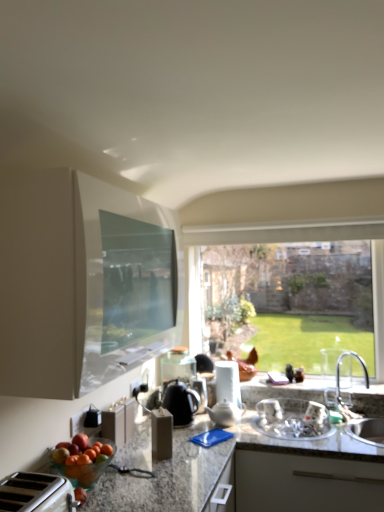
Describe the element at coordinates (367, 431) in the screenshot. This screenshot has height=512, width=384. I see `white ceramic sink at right, arranged as the 1th sink when viewed from the right` at that location.

Measure the distance between point [356,225] and camera.

Point [356,225] and camera are 8.39 feet apart.

Measure the distance between white glossy kettle at center, the 2th appliance when ordered from front to back, and camera.

They are 2.30 meters apart.

In order to face white glossy kettle at center, which is the second appliance in back-to-front order, should I rotate leftwards or rightwards?

Turn right approximately 1.144 degrees to face it.

What do you see at coordinates (228, 382) in the screenshot?
I see `white glossy paper towel dispenser at center, which is counted as the third appliance, starting from the front` at bounding box center [228, 382].

Locate an element on the screen. The width and height of the screenshot is (384, 512). white glossy cabinet at upper left, which is the second cabinetry from bottom to top is located at coordinates (80, 282).

At what (x,y) coordinates should I click in order to perform the action: click on white glossy sink at lower center, the 1th sink in the left-to-right sequence. Please return your answer as a coordinate pair (x, y). The height and width of the screenshot is (512, 384). Looking at the image, I should click on (293, 419).

From the image's perspective, which appliance is the 1st one below the clear glass window at center? Please provide its 2D coordinates.

[(228, 382)]

From a real-world perspective, which is physically above, white glossy paper towel dispenser at center, acting as the 1th appliance starting from the right, or clear glass window at center?

clear glass window at center is physically above.

Considering the relative positions of white glossy paper towel dispenser at center, which is counted as the third appliance, starting from the front, and clear glass window at center in the image provided, is white glossy paper towel dispenser at center, which is counted as the third appliance, starting from the front, to the right of clear glass window at center from the viewer's perspective?

No, white glossy paper towel dispenser at center, which is counted as the third appliance, starting from the front, is not to the right of clear glass window at center.

Is white glossy kettle at center, positioned as the second appliance in right-to-left order, at the back of clear glass window at center?

No, clear glass window at center is not facing the opposite direction of white glossy kettle at center, positioned as the second appliance in right-to-left order.

In order to click on window located behind the white glossy kettle at center, the 2th appliance when ordered from front to back in this screenshot , I will do `click(312, 239)`.

How many degrees apart are the facing directions of clear glass window at center and white glossy kettle at center, which is the 2th appliance from left to right?

The facing directions of clear glass window at center and white glossy kettle at center, which is the 2th appliance from left to right, are 4.83 degrees apart.

Considering the sizes of objects white glossy sink at lower center, the second sink from the right, and translucent glass bowl of mixed fruits at lower left in the image provided, who is smaller, white glossy sink at lower center, the second sink from the right, or translucent glass bowl of mixed fruits at lower left?

With smaller size is translucent glass bowl of mixed fruits at lower left.

Where is `fruit above the white glossy sink at lower center, the 1th sink in the left-to-right sequence (from the image's perspective)`? This screenshot has height=512, width=384. fruit above the white glossy sink at lower center, the 1th sink in the left-to-right sequence (from the image's perspective) is located at coordinates (85, 468).

Based on the photo, from the image's perspective, which is above, white glossy sink at lower center, the second sink from the right, or translucent glass bowl of mixed fruits at lower left?

translucent glass bowl of mixed fruits at lower left appears higher in the image.

Between white glossy sink at lower center, the 1th sink in the left-to-right sequence, and translucent glass bowl of mixed fruits at lower left, which one is positioned in front?

translucent glass bowl of mixed fruits at lower left is more forward.

Does white glossy sink at lower center, the second sink from the right, have a smaller size compared to clear glass window at center?

Yes, white glossy sink at lower center, the second sink from the right, is smaller than clear glass window at center.

Which is behind, white glossy sink at lower center, the 1th sink in the left-to-right sequence, or clear glass window at center?

clear glass window at center is further away from the camera.

Could you tell me if white glossy sink at lower center, the 1th sink in the left-to-right sequence, is facing clear glass window at center?

No, white glossy sink at lower center, the 1th sink in the left-to-right sequence, is not facing towards clear glass window at center.

Considering the relative sizes of white glossy sink at lower center, the second sink from the right, and clear glass window at center in the image provided, is white glossy sink at lower center, the second sink from the right, taller than clear glass window at center?

No.

Considering the relative sizes of white glossy sink at lower center, the second sink from the right, and white ceramic sink at right, placed as the second sink when sorted from left to right, in the image provided, is white glossy sink at lower center, the second sink from the right, taller than white ceramic sink at right, placed as the second sink when sorted from left to right,?

No, white glossy sink at lower center, the second sink from the right, is not taller than white ceramic sink at right, placed as the second sink when sorted from left to right.

Considering the sizes of objects white glossy sink at lower center, the 1th sink in the left-to-right sequence, and white ceramic sink at right, arranged as the 1th sink when viewed from the right, in the image provided, who is bigger, white glossy sink at lower center, the 1th sink in the left-to-right sequence, or white ceramic sink at right, arranged as the 1th sink when viewed from the right,?

white ceramic sink at right, arranged as the 1th sink when viewed from the right, is bigger.

From a real-world perspective, is white glossy sink at lower center, the 1th sink in the left-to-right sequence, above or below white ceramic sink at right, placed as the second sink when sorted from left to right?

In terms of real-world spatial position, white glossy sink at lower center, the 1th sink in the left-to-right sequence, is below white ceramic sink at right, placed as the second sink when sorted from left to right.

What's the angular difference between white glossy sink at lower center, the second sink from the right, and white ceramic sink at right, arranged as the 1th sink when viewed from the right,'s facing directions?

There is a 0.000408-degree angle between the facing directions of white glossy sink at lower center, the second sink from the right, and white ceramic sink at right, arranged as the 1th sink when viewed from the right.

How different are the orientations of white glossy kettle at center, which is the second appliance in back-to-front order, and matte white toaster at lower center, the second cabinetry viewed from the top, in degrees?

The angle between the facing direction of white glossy kettle at center, which is the second appliance in back-to-front order, and the facing direction of matte white toaster at lower center, the second cabinetry viewed from the top, is 95.1 degrees.

In order to click on the 2nd cabinetry counting from the left side of the white glossy kettle at center, which is the second appliance in back-to-front order in this screenshot , I will do `click(119, 421)`.

From a real-world perspective, which object stands above the other?

In real-world perspective, white glossy kettle at center, which is the 2th appliance from left to right, is above.

Which is behind, white glossy kettle at center, positioned as the second appliance in right-to-left order, or matte white toaster at lower center, acting as the first cabinetry starting from the bottom?

white glossy kettle at center, positioned as the second appliance in right-to-left order, is more distant.

Is white glossy cabinet at upper left, which is the second cabinetry from bottom to top, aimed at granite countertop at lower left?

No.

From the image's perspective, who appears lower, white glossy cabinet at upper left, the first cabinetry in the top-to-bottom sequence, or granite countertop at lower left?

granite countertop at lower left.

Measure the distance from white glossy cabinet at upper left, the first cabinetry in the top-to-bottom sequence, to granite countertop at lower left.

white glossy cabinet at upper left, the first cabinetry in the top-to-bottom sequence, and granite countertop at lower left are 22.84 inches apart from each other.

In terms of width, does white glossy cabinet at upper left, which is the second cabinetry from bottom to top, look wider or thinner when compared to granite countertop at lower left?

In the image, white glossy cabinet at upper left, which is the second cabinetry from bottom to top, appears to be more narrow than granite countertop at lower left.

Where is `window behind the white glossy paper towel dispenser at center, the 1th appliance in the back-to-front sequence`? window behind the white glossy paper towel dispenser at center, the 1th appliance in the back-to-front sequence is located at coordinates (312, 239).

From the clear glass window at center, count 2nd appliances forward and point to it. Please provide its 2D coordinates.

[(200, 391)]

Based on their spatial positions, is matte white toaster at lower center, acting as the first cabinetry starting from the bottom, or white glossy cabinet at upper left, the first cabinetry in the top-to-bottom sequence, closer to granite countertop at lower left?

matte white toaster at lower center, acting as the first cabinetry starting from the bottom.

When comparing their distances from black glossy tea pot at center, which ranks as the 2th tea pot in right-to-left order, does white ceramic teapot at center, which is the first tea pot from right to left, or white glossy cabinet at upper left, the first cabinetry in the top-to-bottom sequence, seem further?

white glossy cabinet at upper left, the first cabinetry in the top-to-bottom sequence, is positioned further to the anchor black glossy tea pot at center, which ranks as the 2th tea pot in right-to-left order.

When comparing their distances from white plastic toaster at lower left, the first appliance when ordered from left to right, does white glossy cabinet at upper left, which is the second cabinetry from bottom to top, or white glossy kettle at center, which is the second appliance in back-to-front order, seem further?

Based on the image, white glossy kettle at center, which is the second appliance in back-to-front order, appears to be further to white plastic toaster at lower left, the first appliance when ordered from left to right.

From the image, which object appears to be farther from clear glass window at center, white glossy sink at lower center, the second sink from the right, or matte white toaster at lower center, acting as the first cabinetry starting from the bottom?

Among the two, matte white toaster at lower center, acting as the first cabinetry starting from the bottom, is located further to clear glass window at center.

Considering their positions, is black glossy tea pot at center, which ranks as the 2th tea pot in right-to-left order, positioned further to white glossy sink at lower center, the second sink from the right, than granite countertop at lower left?

black glossy tea pot at center, which ranks as the 2th tea pot in right-to-left order, is further to white glossy sink at lower center, the second sink from the right.

Looking at the image, which one is located further to black glossy tea pot at center, which ranks as the 1th tea pot in left-to-right order, white glossy paper towel dispenser at center, which is counted as the third appliance, starting from the front, or white ceramic teapot at center, positioned as the second tea pot in left-to-right order?

The object further to black glossy tea pot at center, which ranks as the 1th tea pot in left-to-right order, is white glossy paper towel dispenser at center, which is counted as the third appliance, starting from the front.

Based on their spatial positions, is matte white toaster at lower center, acting as the first cabinetry starting from the bottom, or granite countertop at lower left closer to white glossy cabinet at upper left, which is the second cabinetry from bottom to top?

The object closer to white glossy cabinet at upper left, which is the second cabinetry from bottom to top, is granite countertop at lower left.

Which object lies further to the anchor point granite countertop at lower left, white ceramic teapot at center, positioned as the second tea pot in left-to-right order, or white glossy cabinet at upper left, the first cabinetry in the top-to-bottom sequence?

white glossy cabinet at upper left, the first cabinetry in the top-to-bottom sequence, is further to granite countertop at lower left.

Locate an element on the screen. sink situated between white glossy kettle at center, the 2th appliance when ordered from front to back, and white ceramic sink at right, arranged as the 1th sink when viewed from the right, from left to right is located at coordinates (293, 419).

At what (x,y) coordinates should I click in order to perform the action: click on cabinetry between white glossy cabinet at upper left, which is the second cabinetry from bottom to top, and black glossy tea pot at center, which ranks as the 1th tea pot in left-to-right order, in the front-back direction. Please return your answer as a coordinate pair (x, y). Image resolution: width=384 pixels, height=512 pixels. Looking at the image, I should click on (x=119, y=421).

I want to click on sink between granite countertop at lower left and white ceramic sink at right, placed as the second sink when sorted from left to right, along the z-axis, so tap(293, 419).

You are a GUI agent. You are given a task and a screenshot of the screen. Output one action in this format:
    pyautogui.click(x=<x>, y=<y>)
    Task: Click on the sink situated between black glossy tea pot at center, which ranks as the 2th tea pot in right-to-left order, and white ceramic sink at right, arranged as the 1th sink when viewed from the right, from left to right
    This screenshot has height=512, width=384.
    Given the screenshot: What is the action you would take?
    pyautogui.click(x=293, y=419)